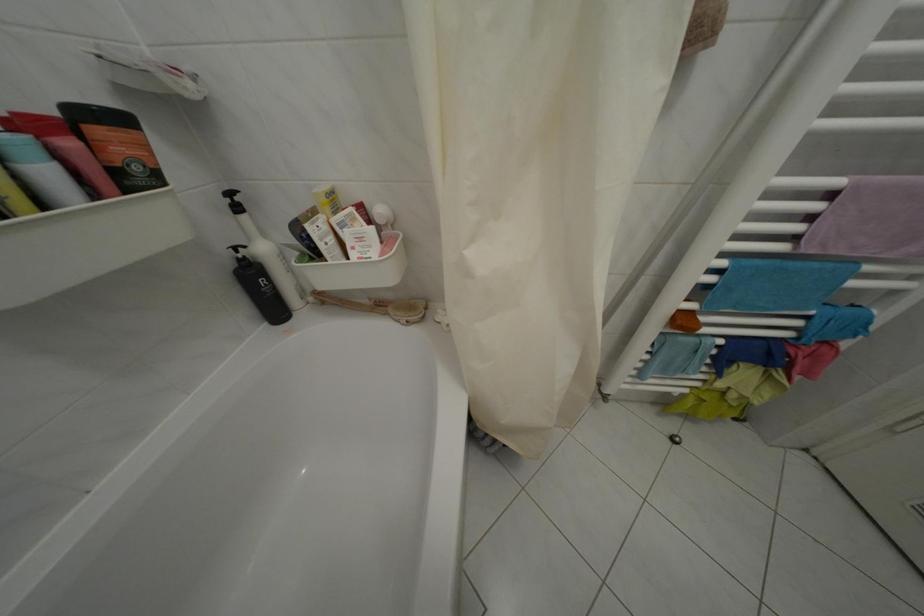
Which object does [273,264] point to?

It corresponds to the white cosmetic tube in the image.